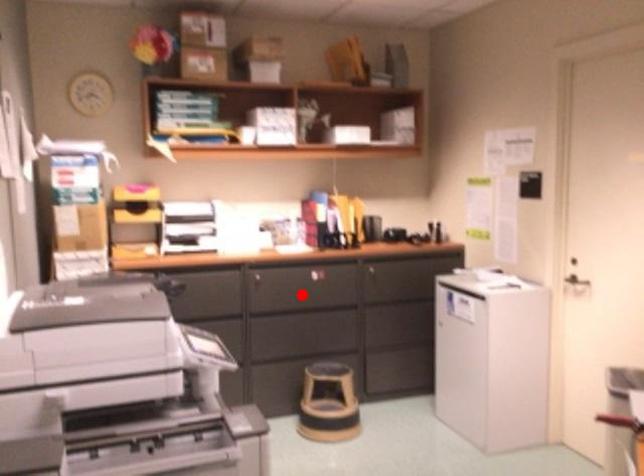
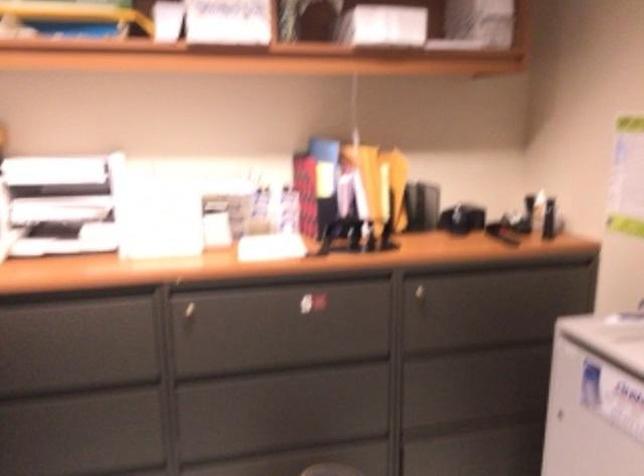
The point at the highlighted location is marked in the first image. Where is the corresponding point in the second image?

(279, 338)